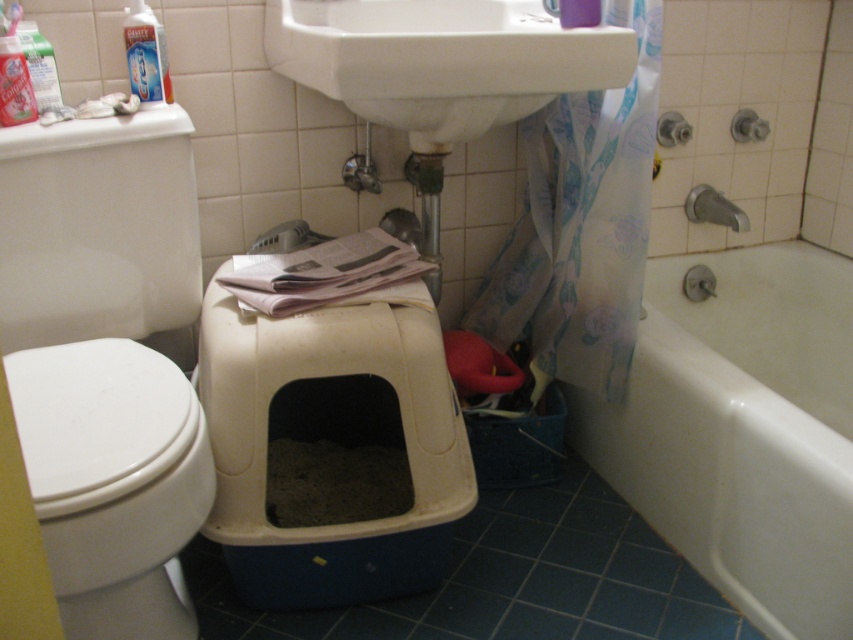
Who is lower down, white glossy toilet lid at left or matte silver faucet at upper right?

Positioned lower is white glossy toilet lid at left.

Where is `white glossy toilet lid at left`? The height and width of the screenshot is (640, 853). white glossy toilet lid at left is located at coordinates (97, 420).

Is point (67, 403) positioned in front of point (695, 220)?

Yes, point (67, 403) is closer to viewer.

Find the location of `white glossy toilet lid at left`. white glossy toilet lid at left is located at coordinates (97, 420).

Is white glossy toilet at left thinner than white glossy sink at upper center?

Indeed, white glossy toilet at left has a lesser width compared to white glossy sink at upper center.

Consider the image. Which is above, white glossy toilet at left or white glossy sink at upper center?

white glossy sink at upper center

Is point (7, 285) farther from camera compared to point (618, 29)?

Yes.

Locate an element on the screen. white glossy toilet at left is located at coordinates (97, 230).

Does translucent floral fabric at lower center have a smaller size compared to matte silver faucet at upper right?

No.

Measure the distance between translucent floral fabric at lower center and matte silver faucet at upper right.

translucent floral fabric at lower center is 40.98 centimeters away from matte silver faucet at upper right.

Which is in front, point (633, 150) or point (715, 220)?

Point (633, 150) is more forward.

Locate an element on the screen. The width and height of the screenshot is (853, 640). translucent floral fabric at lower center is located at coordinates (581, 225).